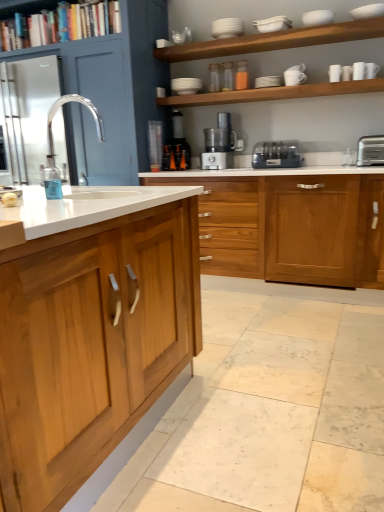
Question: Can black plastic coffee machine at center be found inside wooden cabinet at center, which is the second cabinetry in back-to-front order?

Choices:
 (A) yes
 (B) no

Answer: (B)

Question: Is wooden cabinet at center, which is the second cabinetry in back-to-front order, not close to black plastic coffee machine at center?

Choices:
 (A) no
 (B) yes

Answer: (A)

Question: From a real-world perspective, is wooden cabinet at center, which is the second cabinetry in back-to-front order, on top of black plastic coffee machine at center?

Choices:
 (A) no
 (B) yes

Answer: (A)

Question: Does wooden cabinet at center, which ranks as the 2th cabinetry in front-to-back order, lie behind black plastic coffee machine at center?

Choices:
 (A) yes
 (B) no

Answer: (B)

Question: Can you confirm if wooden cabinet at center, which is the second cabinetry in back-to-front order, is taller than black plastic coffee machine at center?

Choices:
 (A) yes
 (B) no

Answer: (A)

Question: Considering the relative sizes of wooden cabinet at center, which ranks as the 2th cabinetry in front-to-back order, and black plastic coffee machine at center in the image provided, is wooden cabinet at center, which ranks as the 2th cabinetry in front-to-back order, bigger than black plastic coffee machine at center?

Choices:
 (A) yes
 (B) no

Answer: (A)

Question: Is white marble tile at lower center taller than clear glass faucet at center?

Choices:
 (A) yes
 (B) no

Answer: (B)

Question: Considering the relative positions of white marble tile at lower center and clear glass faucet at center in the image provided, is white marble tile at lower center behind clear glass faucet at center?

Choices:
 (A) no
 (B) yes

Answer: (A)

Question: Is white marble tile at lower center located outside clear glass faucet at center?

Choices:
 (A) no
 (B) yes

Answer: (B)

Question: Is white marble tile at lower center touching clear glass faucet at center?

Choices:
 (A) no
 (B) yes

Answer: (A)

Question: Is white marble tile at lower center bigger than clear glass faucet at center?

Choices:
 (A) yes
 (B) no

Answer: (A)

Question: Considering the relative positions of white marble tile at lower center and clear glass faucet at center in the image provided, is white marble tile at lower center to the right of clear glass faucet at center from the viewer's perspective?

Choices:
 (A) yes
 (B) no

Answer: (A)

Question: Can white glossy shelves at upper center, the 1th shelf in the bottom-to-top sequence, be found inside wooden cabinet at center, which is the 3th cabinetry from front to back?

Choices:
 (A) no
 (B) yes

Answer: (A)